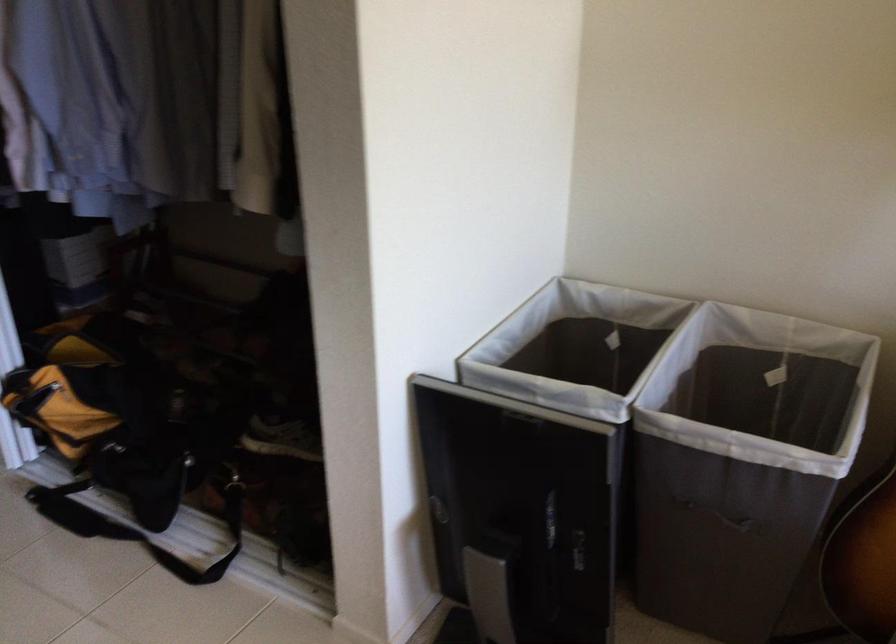
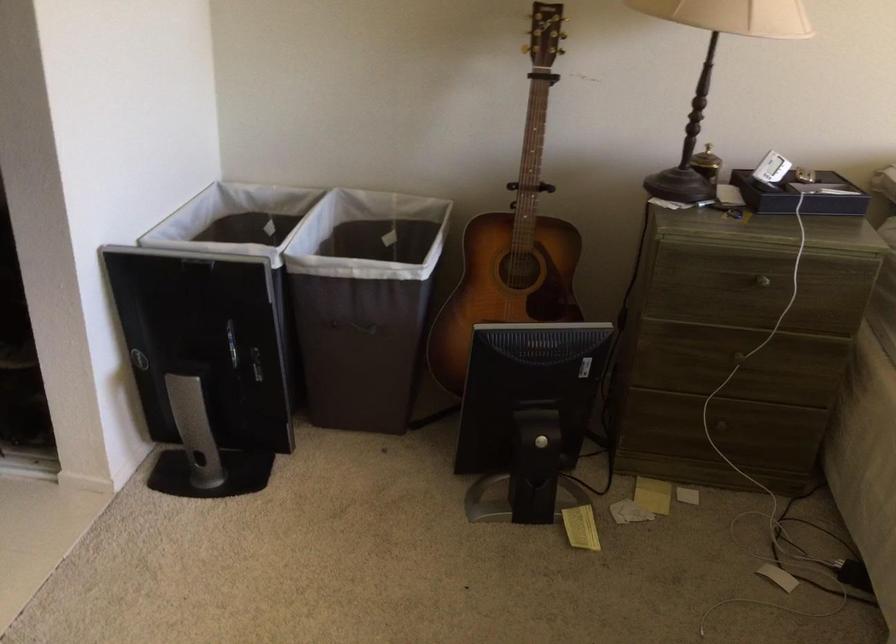
Find the pixel in the second image that matches (719,512) in the first image.

(357, 327)